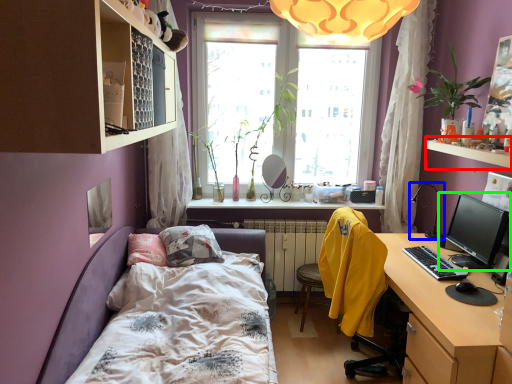
Question: Which is farther away from window sill (highlighted by a red box)? table lamp (highlighted by a blue box) or computer monitor (highlighted by a green box)?

Choices:
 (A) table lamp
 (B) computer monitor

Answer: (A)